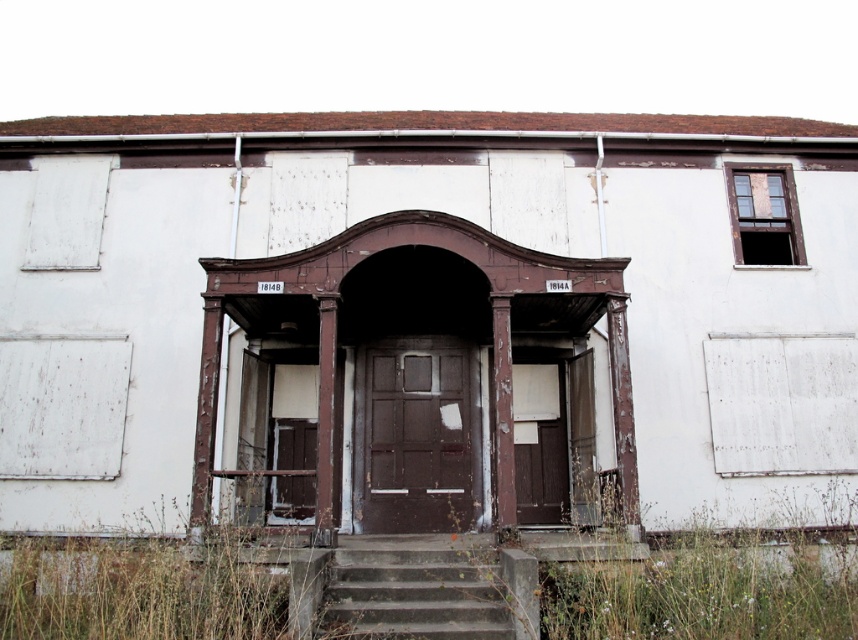
Is brown grass at lower left positioned at the back of brown matte door at center?

No, brown grass at lower left is closer to the viewer.

Does brown grass at lower left have a lesser width compared to brown matte door at center?

No, brown grass at lower left is not thinner than brown matte door at center.

Between point (98, 552) and point (397, 422), which one is positioned in front?

Point (98, 552)

Locate an element on the screen. brown grass at lower left is located at coordinates 144,588.

Between point (140, 595) and point (506, 595), which one is positioned in front?

Point (140, 595)

Is the position of brown grass at lower left more distant than that of concrete/stained stairs at center?

No, it is in front of concrete/stained stairs at center.

This screenshot has width=858, height=640. I want to click on brown grass at lower left, so click(x=144, y=588).

You are a GUI agent. You are given a task and a screenshot of the screen. Output one action in this format:
    pyautogui.click(x=<x>, y=<y>)
    Task: Click on the brown grass at lower left
    The width and height of the screenshot is (858, 640).
    Given the screenshot: What is the action you would take?
    pyautogui.click(x=144, y=588)

Does brown matte door at center appear on the right side of concrete/stained stairs at center?

In fact, brown matte door at center is to the left of concrete/stained stairs at center.

Is brown matte door at center smaller than concrete/stained stairs at center?

Incorrect, brown matte door at center is not smaller in size than concrete/stained stairs at center.

Is point (450, 440) less distant than point (485, 579)?

No, (450, 440) is further to viewer.

At what (x,y) coordinates should I click in order to perform the action: click on brown matte door at center. Please return your answer as a coordinate pair (x, y). Image resolution: width=858 pixels, height=640 pixels. Looking at the image, I should click on (414, 436).